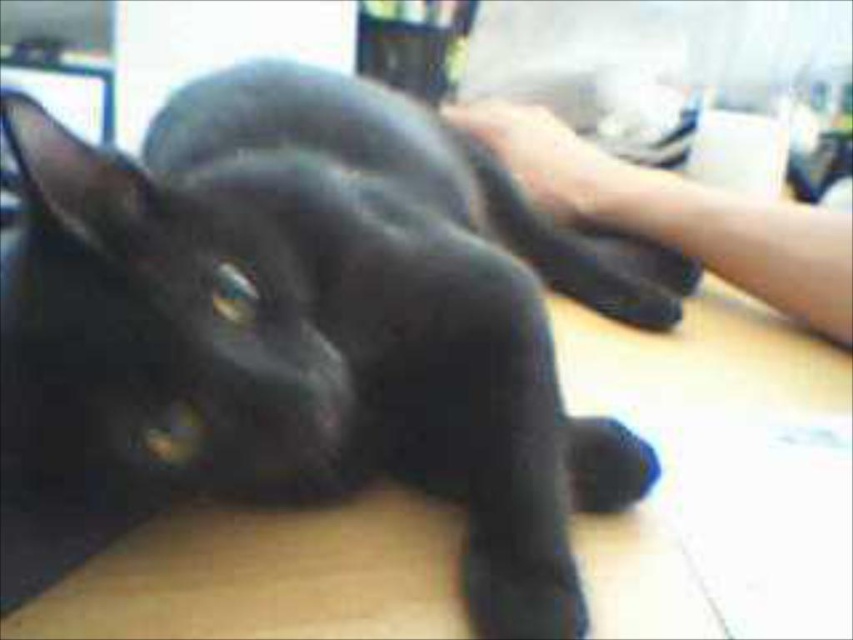
Based on the photo, you are a photographer trying to capture the shiny black cat at center and the black matte paw at center in a single shot. Since you want to focus on the cat, which object should you adjust your camera to prioritize focusing on?

The shiny black cat at center is closer to the viewer than the black matte paw at center, so you should adjust your camera to prioritize focusing on the shiny black cat at center to ensure it is in sharp focus while the paw may be slightly blurred.

You are a photographer trying to capture a closeup of the black matte paw at center. However, the skinny white arm at upper right is blocking your view. Can you move the arm to the side to get a clear shot?

The skinny white arm at upper right is closer to the viewer than the black matte paw at center, so moving the arm would allow you to get a clear shot of the black matte paw at center without obstruction.